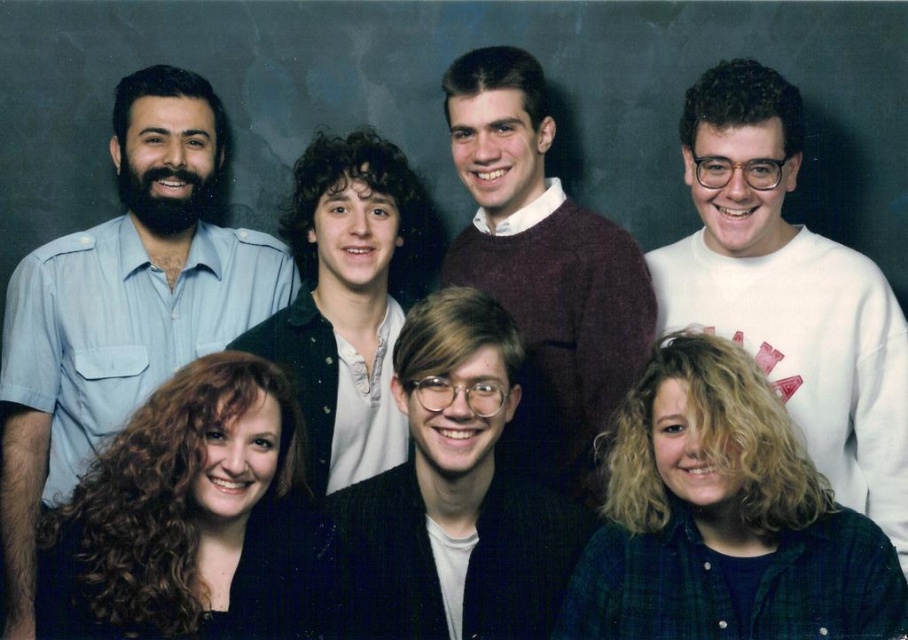
Question: Which object is positioned farthest from the maroon sweater at center?

Choices:
 (A) dark brown textured blazer at center
 (B) light blue shirt at left
 (C) white cotton sweatshirt at upper right

Answer: (B)

Question: Which point appears farthest from the camera in this image?

Choices:
 (A) (526, 467)
 (B) (176, 330)
 (C) (691, 252)

Answer: (B)

Question: Which point is farther to the camera?

Choices:
 (A) (563, 476)
 (B) (352, 588)
 (C) (847, 321)

Answer: (A)

Question: Considering the relative positions of dark brown textured blazer at center and maroon sweater at center in the image provided, where is dark brown textured blazer at center located with respect to maroon sweater at center?

Choices:
 (A) above
 (B) below

Answer: (B)

Question: Can you confirm if light blue shirt at left is positioned to the left of dark brown textured blazer at center?

Choices:
 (A) no
 (B) yes

Answer: (B)

Question: Does light blue shirt at left have a smaller size compared to dark brown textured blazer at center?

Choices:
 (A) no
 (B) yes

Answer: (A)